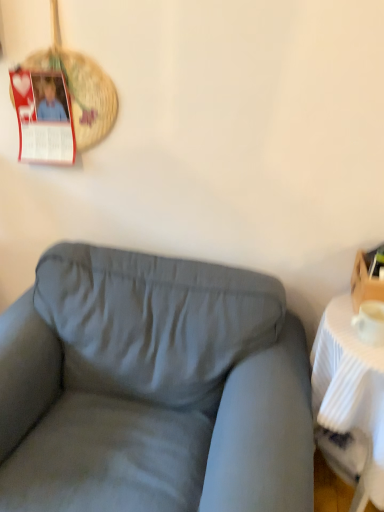
Question: In terms of size, does suede gray couch at center appear bigger or smaller than woven straw basket at upper left?

Choices:
 (A) small
 (B) big

Answer: (B)

Question: Considering the positions of suede gray couch at center and woven straw basket at upper left in the image, is suede gray couch at center wider or thinner than woven straw basket at upper left?

Choices:
 (A) thin
 (B) wide

Answer: (B)

Question: Estimate the real-world distances between objects in this image. Which object is closer to the suede gray couch at center?

Choices:
 (A) wooden box at right
 (B) woven straw basket at upper left
 (C) white ribbed table at right

Answer: (C)

Question: Which is nearer to the white ribbed table at right?

Choices:
 (A) woven straw basket at upper left
 (B) wooden box at right
 (C) suede gray couch at center

Answer: (B)